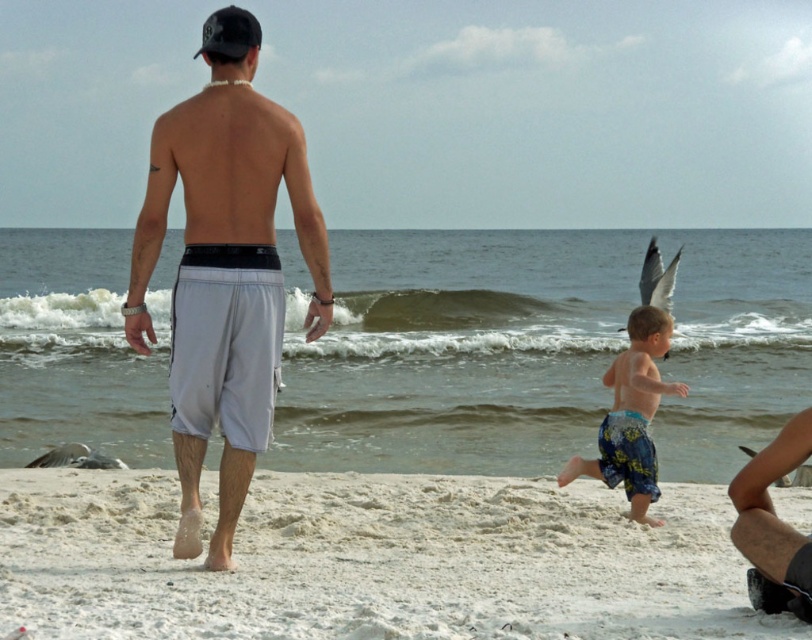
You are standing on the white sandy beach at lower center and looking up. Do you see the white matte shorts at center above you?

Yes, the white sandy beach at lower center is located below the white matte shorts at center, so when looking up from the beach, the white matte shorts at center would be above.

You are standing at the camera position and want to walk directly to the white sandy beach at lower center. What direction should you move relative to the man walking away from the camera?

Since the white sandy beach at lower center is located at point coordinates, you would need to move towards the lower center direction relative to the man walking away from the camera. However, without specific coordinate system details, the general direction would be towards the lower center area where the beach is positioned.